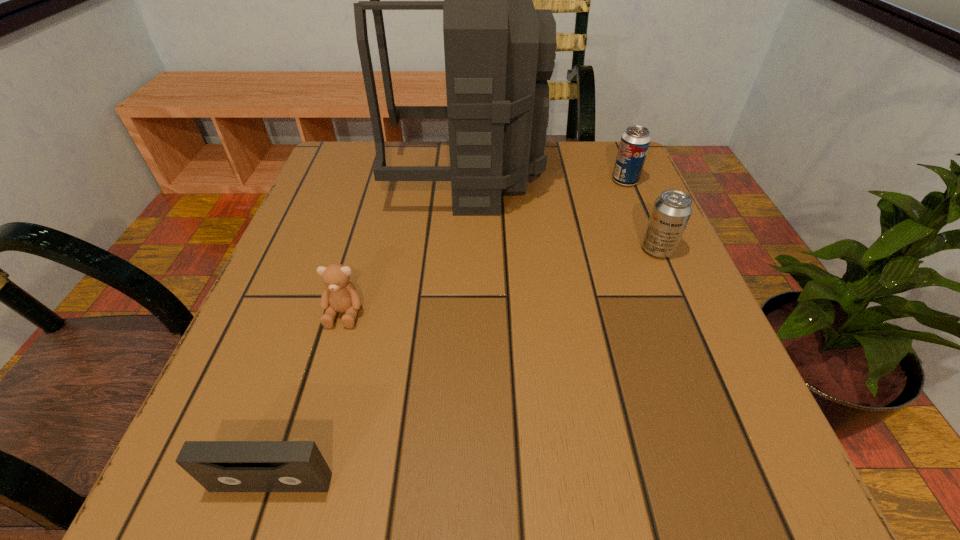
Where is `vacant space at the far left corner of the desktop`? Image resolution: width=960 pixels, height=540 pixels. vacant space at the far left corner of the desktop is located at coordinates (397, 148).

I want to click on vacant space at the far right corner of the desktop, so click(618, 145).

You are a GUI agent. You are given a task and a screenshot of the screen. Output one action in this format:
    pyautogui.click(x=<x>, y=<y>)
    Task: Click on the free space between the teddy bear and the farther beer can
    
    Given the screenshot: What is the action you would take?
    pyautogui.click(x=485, y=247)

Image resolution: width=960 pixels, height=540 pixels. Find the location of `free space between the teddy bear and the third farthest object`. free space between the teddy bear and the third farthest object is located at coordinates (501, 281).

What are the coordinates of `vacant space that is in between the farther beer can and the tallest object` in the screenshot? It's located at (545, 179).

Locate an element on the screen. The height and width of the screenshot is (540, 960). unoccupied position between the farther beer can and the backpack is located at coordinates (545, 179).

Where is `free space between the third farthest object and the backpack`? The width and height of the screenshot is (960, 540). free space between the third farthest object and the backpack is located at coordinates (562, 213).

You are a GUI agent. You are given a task and a screenshot of the screen. Output one action in this format:
    pyautogui.click(x=<x>, y=<y>)
    Task: Click on the unoccupied position between the nearer beer can and the videotape
    The image size is (960, 540).
    Given the screenshot: What is the action you would take?
    pyautogui.click(x=465, y=366)

Locate an element on the screen. This screenshot has height=540, width=960. free area in between the nearest object and the third nearest object is located at coordinates (465, 366).

The height and width of the screenshot is (540, 960). Find the location of `free point between the nearest object and the farther beer can`. free point between the nearest object and the farther beer can is located at coordinates (448, 332).